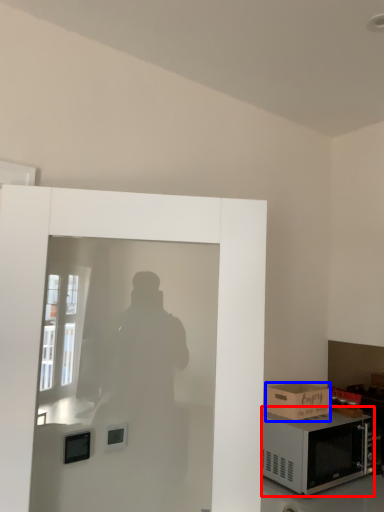
Question: Among these objects, which one is farthest to the camera, microwave oven (highlighted by a red box) or box (highlighted by a blue box)?

Choices:
 (A) microwave oven
 (B) box

Answer: (B)